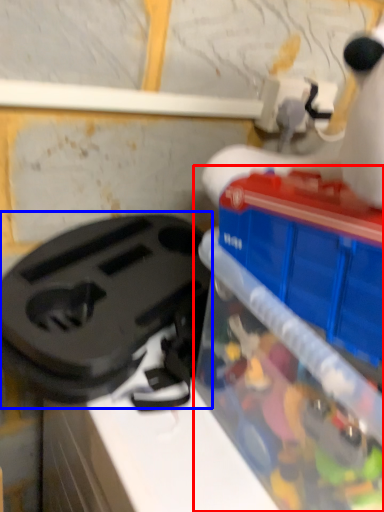
Question: Which object is further to the camera taking this photo, toy (highlighted by a red box) or appliance (highlighted by a blue box)?

Choices:
 (A) toy
 (B) appliance

Answer: (B)